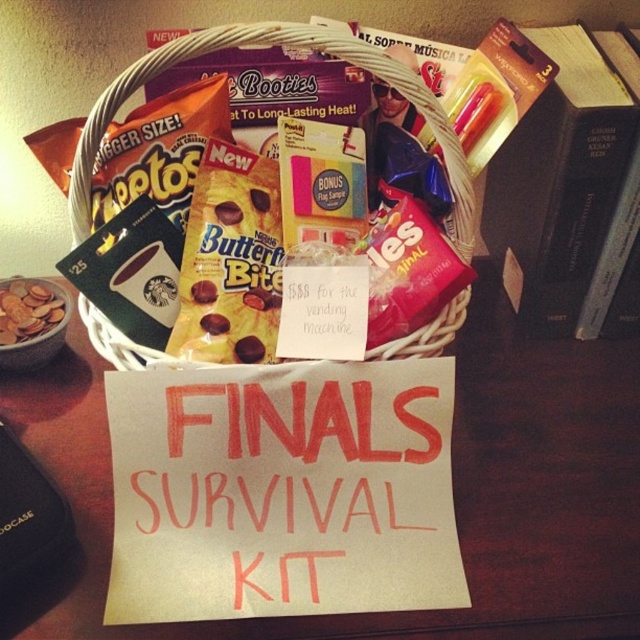
You are a student trying to reach the wooden table at center from your current position. Can you estimate how far you need to walk to reach it?

The wooden table at center is 22.74 inches away from the camera, so you need to walk approximately 22.74 inches to reach it.

You are organizing a Finals Survival Kit and need to place the matte brown cookies at lower left near the wooden table at center. Based on the scene description, which direction should you move the cookies to place them closer to the table?

The wooden table at center is to the right of the matte brown cookies at lower left, so you should move the cookies to the right to place them closer to the table.